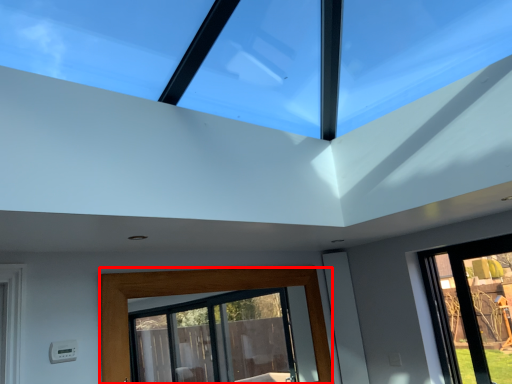
Question: Observing the image, what is the correct spatial positioning of window (annotated by the red box) in reference to window?

Choices:
 (A) right
 (B) left

Answer: (B)